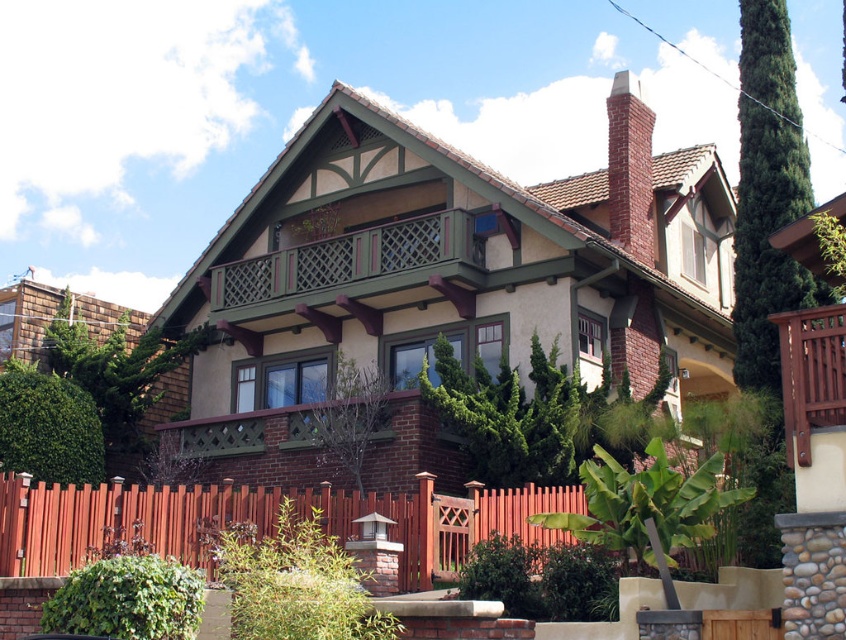
This screenshot has width=846, height=640. What do you see at coordinates (810, 374) in the screenshot? I see `brown wooden balcony at center` at bounding box center [810, 374].

Does point (828, 368) lie in front of point (641, 205)?

Yes, it is in front of point (641, 205).

Identify the location of brown wooden balcony at center. (810, 374).

Between brown wood fence at lower center and red brick chimney at upper right, which one is positioned lower?

brown wood fence at lower center is below.

Can you confirm if brown wood fence at lower center is thinner than red brick chimney at upper right?

No, brown wood fence at lower center is not thinner than red brick chimney at upper right.

Does point (133, 486) come closer to viewer compared to point (633, 156)?

Yes, point (133, 486) is in front of point (633, 156).

Identify the location of brown wood fence at lower center. (262, 520).

Which is more to the right, green wood balcony at upper center or red brick chimney at upper right?

Positioned to the right is red brick chimney at upper right.

Looking at this image, who is shorter, green wood balcony at upper center or red brick chimney at upper right?

green wood balcony at upper center

Is point (266, 292) positioned before point (628, 145)?

No, it is behind (628, 145).

Find the location of a particular element. green wood balcony at upper center is located at coordinates (350, 266).